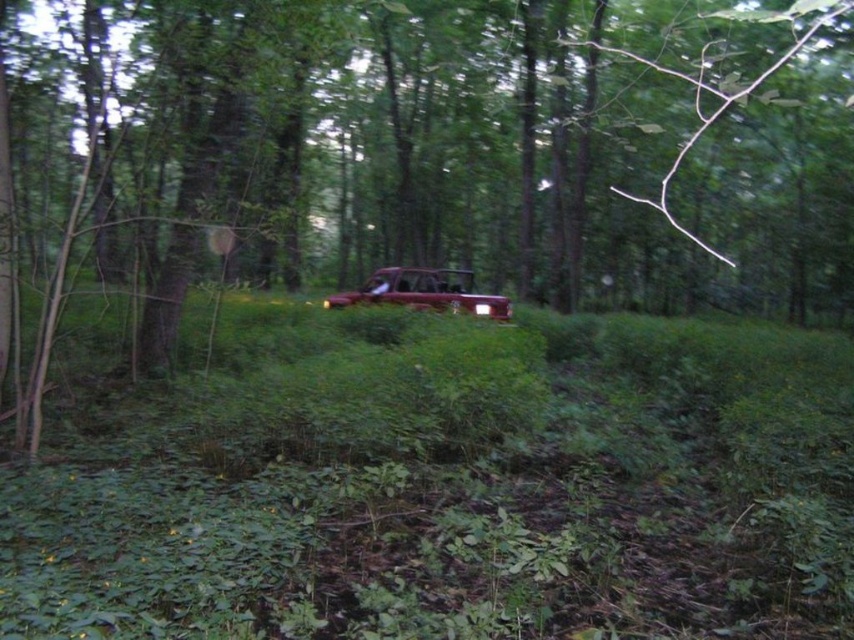
Does green matte tree at center have a greater width compared to shiny maroon car at center?

Indeed, green matte tree at center has a greater width compared to shiny maroon car at center.

Can you confirm if green matte tree at center is taller than shiny maroon car at center?

Yes.

Measure the distance between point (367,68) and camera.

Point (367,68) and camera are 30.36 meters apart from each other.

The width and height of the screenshot is (854, 640). Find the location of `green matte tree at center`. green matte tree at center is located at coordinates [x=420, y=156].